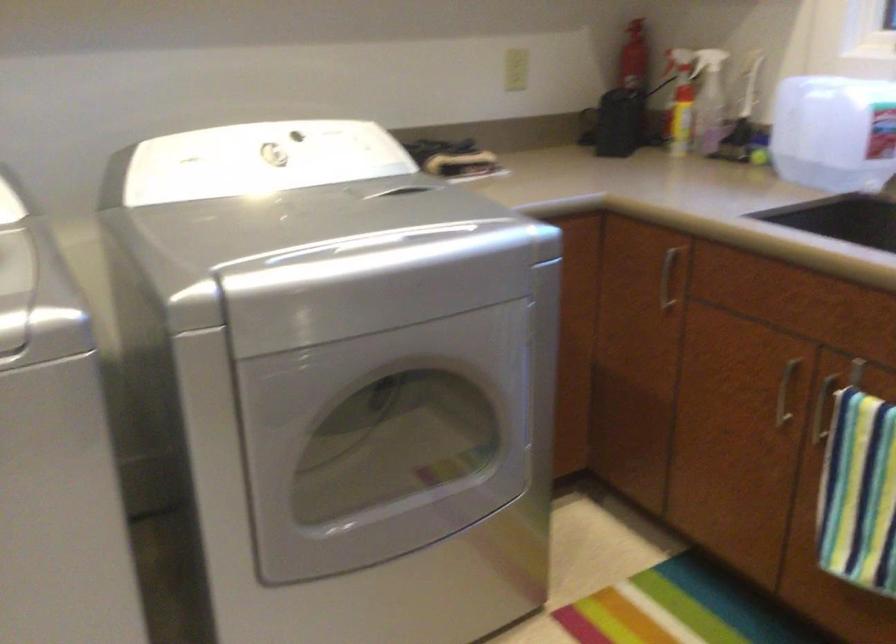
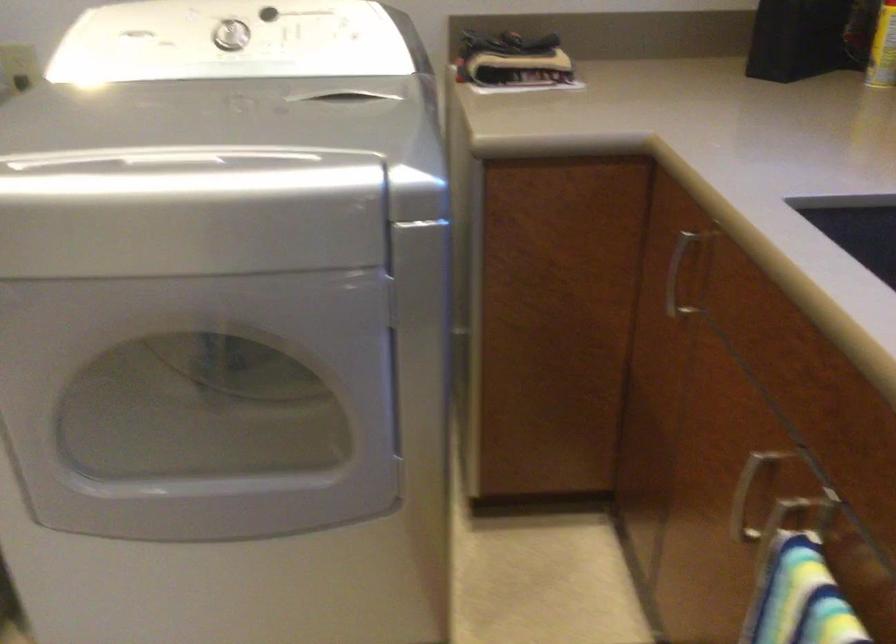
Find the pixel in the second image that matches point (368, 245) in the first image.

(178, 160)